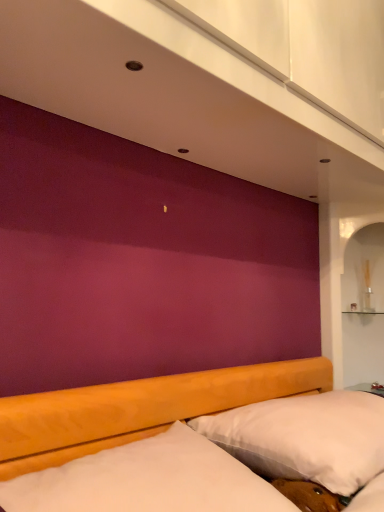
Question: From a real-world perspective, is white soft pillow at lower right positioned over white soft mattress at lower center based on gravity?

Choices:
 (A) no
 (B) yes

Answer: (B)

Question: Could you tell me if white soft pillow at lower right is turned towards white soft mattress at lower center?

Choices:
 (A) no
 (B) yes

Answer: (A)

Question: Considering the relative positions of white soft pillow at lower right and white soft mattress at lower center in the image provided, is white soft pillow at lower right to the right of white soft mattress at lower center from the viewer's perspective?

Choices:
 (A) yes
 (B) no

Answer: (A)

Question: Is white soft pillow at lower right not within white soft mattress at lower center?

Choices:
 (A) no
 (B) yes

Answer: (B)

Question: From the image's perspective, would you say white soft pillow at lower right is shown under white soft mattress at lower center?

Choices:
 (A) yes
 (B) no

Answer: (A)

Question: Would you say white soft pillow at lower right is a long distance from white soft mattress at lower center?

Choices:
 (A) no
 (B) yes

Answer: (A)

Question: Is white soft mattress at lower center directly adjacent to metallic silver table at lower right?

Choices:
 (A) no
 (B) yes

Answer: (A)

Question: Is white soft mattress at lower center positioned with its back to metallic silver table at lower right?

Choices:
 (A) yes
 (B) no

Answer: (B)

Question: Can you confirm if white soft mattress at lower center is smaller than metallic silver table at lower right?

Choices:
 (A) no
 (B) yes

Answer: (A)

Question: Considering the relative sizes of white soft mattress at lower center and metallic silver table at lower right in the image provided, is white soft mattress at lower center bigger than metallic silver table at lower right?

Choices:
 (A) yes
 (B) no

Answer: (A)

Question: From a real-world perspective, is white soft mattress at lower center physically above metallic silver table at lower right?

Choices:
 (A) yes
 (B) no

Answer: (B)

Question: Can you confirm if white soft mattress at lower center is taller than metallic silver table at lower right?

Choices:
 (A) yes
 (B) no

Answer: (A)

Question: Is the surface of metallic silver table at lower right in direct contact with white soft pillow at lower right?

Choices:
 (A) yes
 (B) no

Answer: (B)